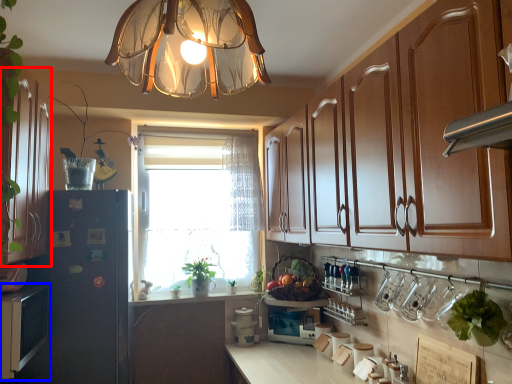
Question: Which of the following is the farthest to the observer, cabinetry (highlighted by a red box) or cabinetry (highlighted by a blue box)?

Choices:
 (A) cabinetry
 (B) cabinetry

Answer: (B)